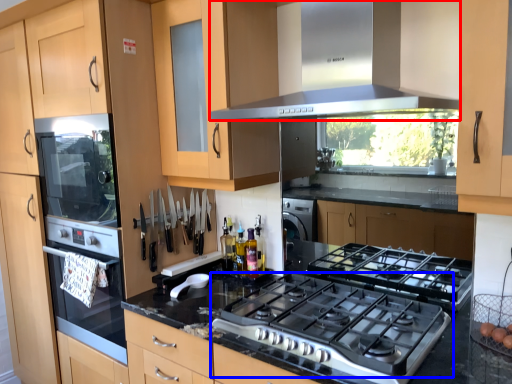
Question: Among these objects, which one is nearest to the camera, home appliance (highlighted by a red box) or gas stove (highlighted by a blue box)?

Choices:
 (A) home appliance
 (B) gas stove

Answer: (A)